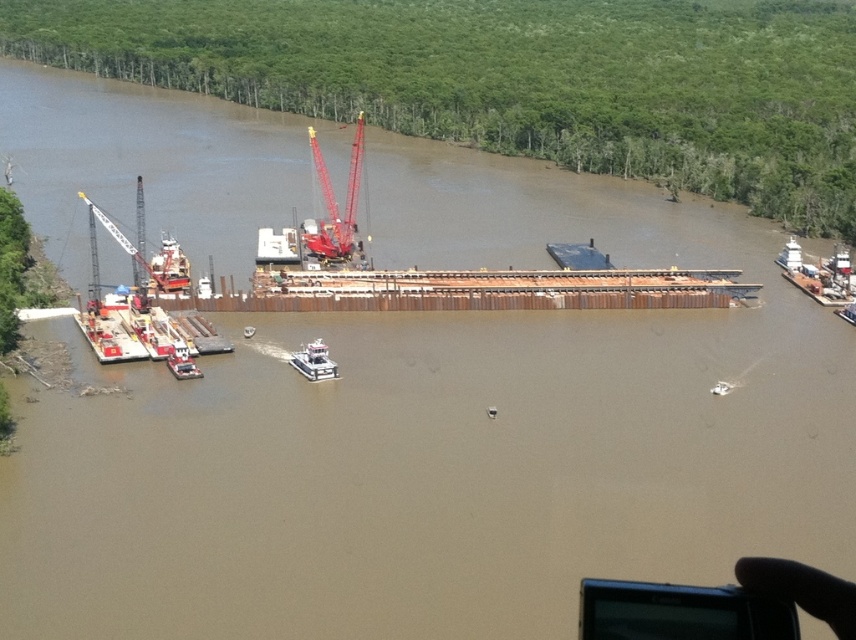
Does white matte barge at center have a lesser height compared to white plastic boat at center?

Incorrect, white matte barge at center's height does not fall short of white plastic boat at center's.

What do you see at coordinates (314, 362) in the screenshot?
I see `white matte barge at center` at bounding box center [314, 362].

Identify the location of white matte barge at center. (314, 362).

Between point (102, 349) and point (187, 378), which one is positioned behind?

Positioned behind is point (102, 349).

Does point (111, 323) lie in front of point (171, 349)?

That is False.

Find the location of a particular element. The width and height of the screenshot is (856, 640). metallic gray barge at lower left is located at coordinates (110, 337).

Between metallic gray barge at lower left and white matte barge at center, which one appears on the right side from the viewer's perspective?

From the viewer's perspective, white matte barge at center appears more on the right side.

This screenshot has width=856, height=640. Identify the location of metallic gray barge at lower left. pyautogui.click(x=110, y=337).